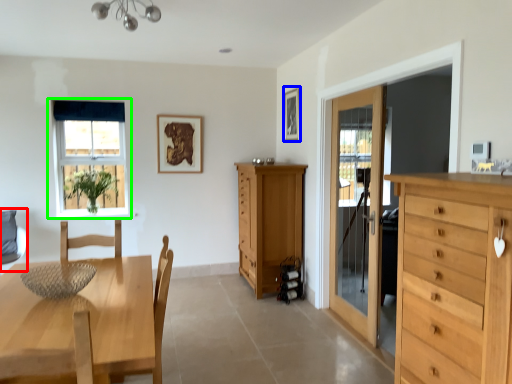
Question: Which object is the closest to the swivel chair (highlighted by a red box)? Choose among these: picture frame (highlighted by a blue box) or window (highlighted by a green box).

Choices:
 (A) picture frame
 (B) window

Answer: (B)